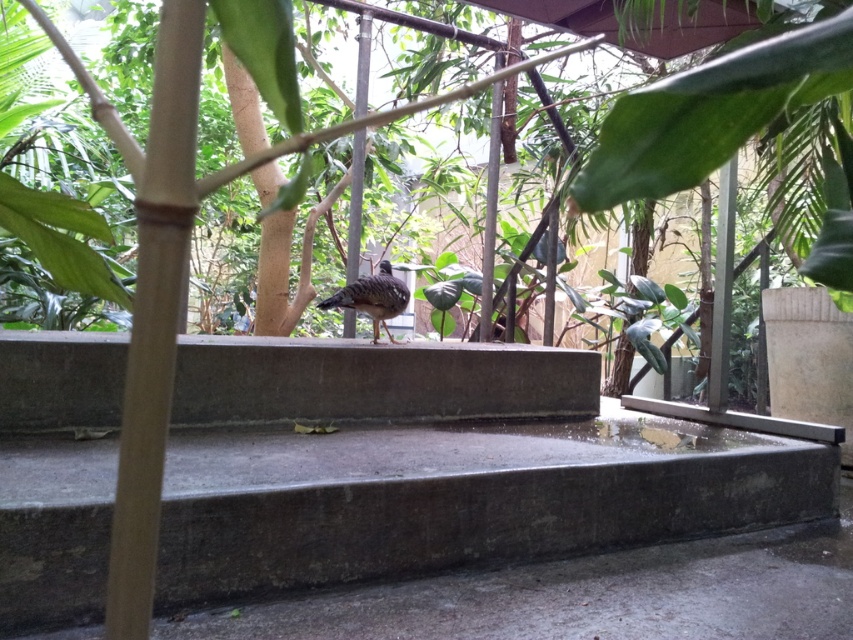
Question: Which object is closer to the camera taking this photo?

Choices:
 (A) speckled feathered bird at center
 (B) concrete stairs at center

Answer: (B)

Question: Which point appears farthest from the camera in this image?

Choices:
 (A) (384, 260)
 (B) (90, 406)

Answer: (A)

Question: Can you confirm if concrete stairs at center is positioned above speckled feathered bird at center?

Choices:
 (A) no
 (B) yes

Answer: (A)

Question: Does concrete stairs at center have a lesser width compared to speckled feathered bird at center?

Choices:
 (A) yes
 (B) no

Answer: (B)

Question: Can you confirm if concrete stairs at center is positioned to the left of speckled feathered bird at center?

Choices:
 (A) no
 (B) yes

Answer: (A)

Question: Which object appears closest to the camera in this image?

Choices:
 (A) speckled feathered bird at center
 (B) concrete stairs at center

Answer: (B)